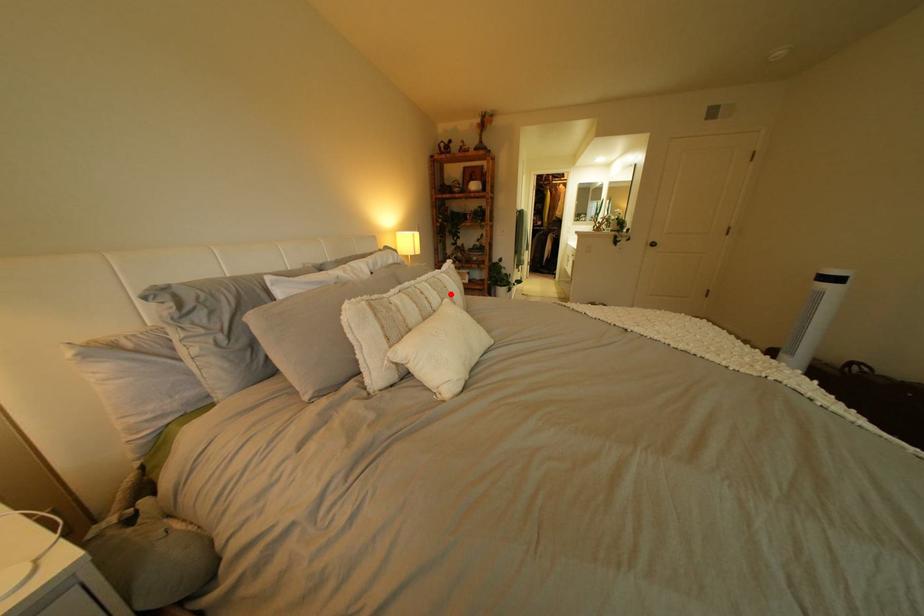
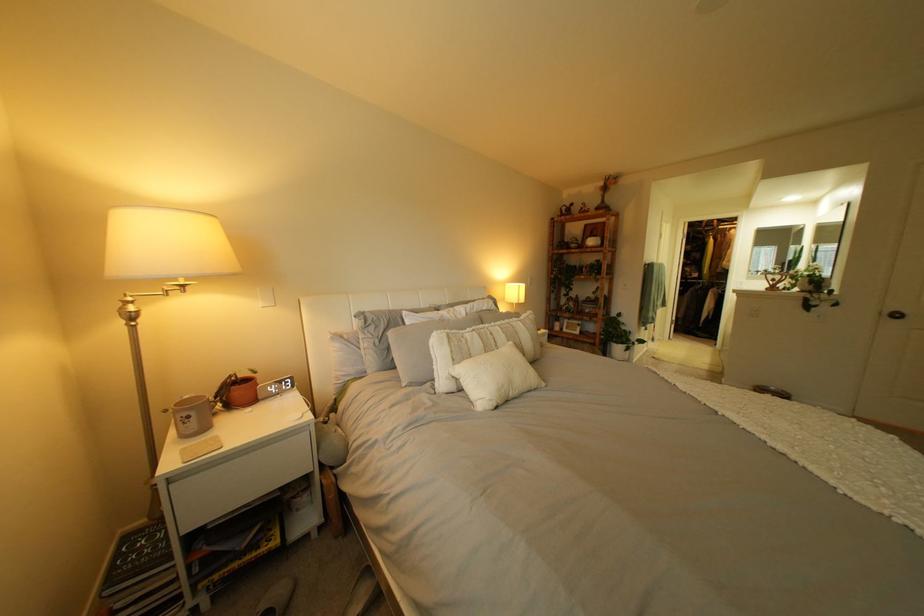
Locate, in the second image, the point that corresponds to the highlighted location in the first image.

(518, 337)